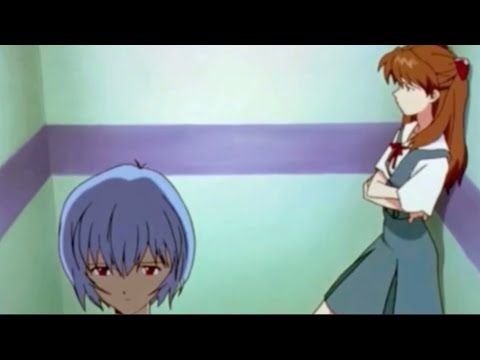
At what (x,y) coordinates should I click in order to perform the action: click on wall. Please return your answer as a coordinate pair (x, y). This screenshot has height=360, width=480. Looking at the image, I should click on (269, 79).